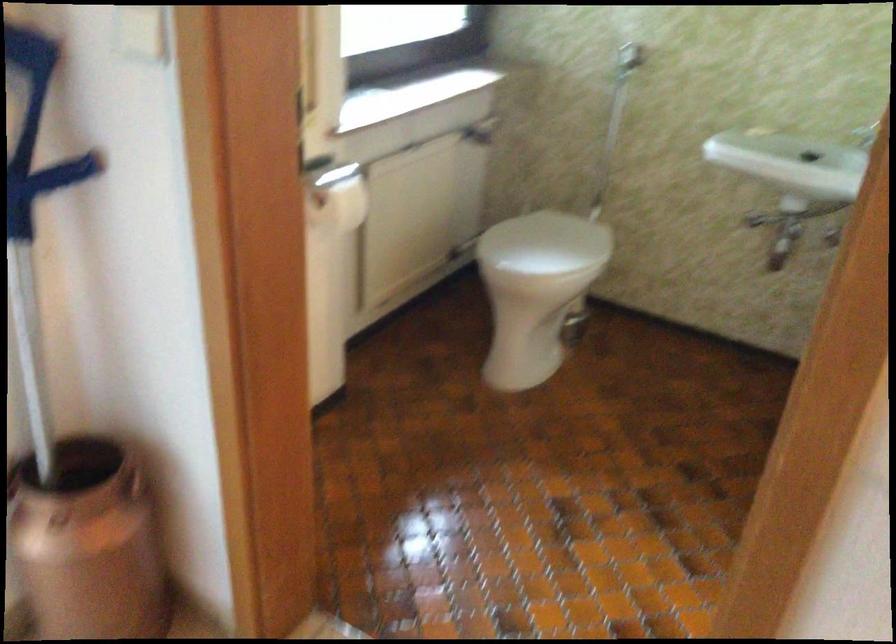
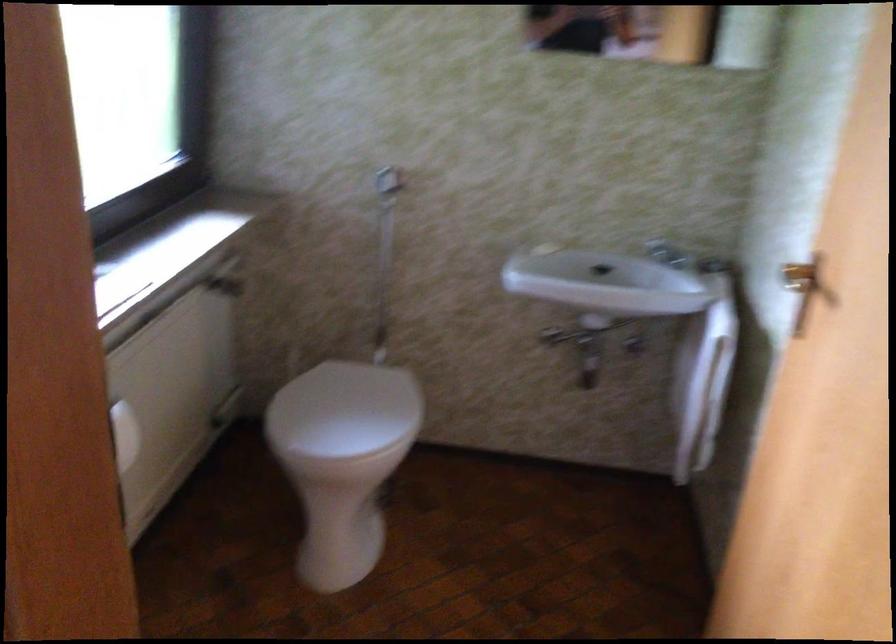
Question: How did the camera likely rotate?

Choices:
 (A) Left
 (B) Right
 (C) Up
 (D) Down

Answer: (B)